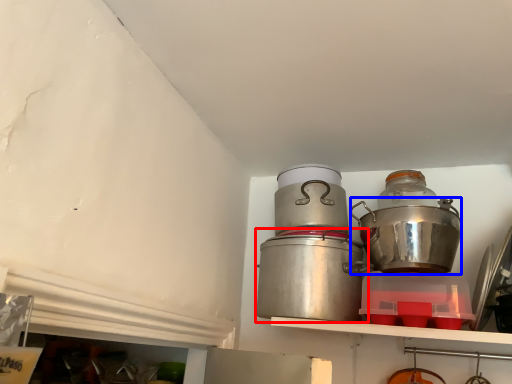
Question: Among these objects, which one is nearest to the camera, crock pot (highlighted by a red box) or crock pot (highlighted by a blue box)?

Choices:
 (A) crock pot
 (B) crock pot

Answer: (B)